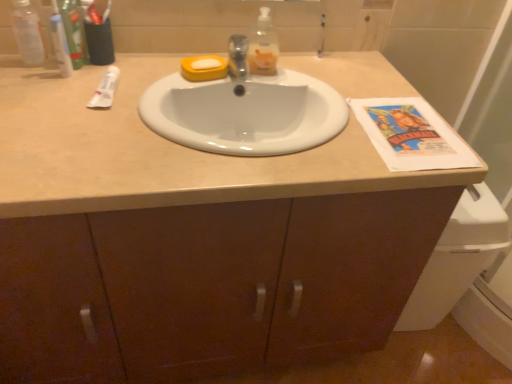
Where is `free space in front of green plastic toothpaste tube at upper left, placed as the 2th toiletry when sorted from right to left`? The image size is (512, 384). free space in front of green plastic toothpaste tube at upper left, placed as the 2th toiletry when sorted from right to left is located at coordinates (55, 93).